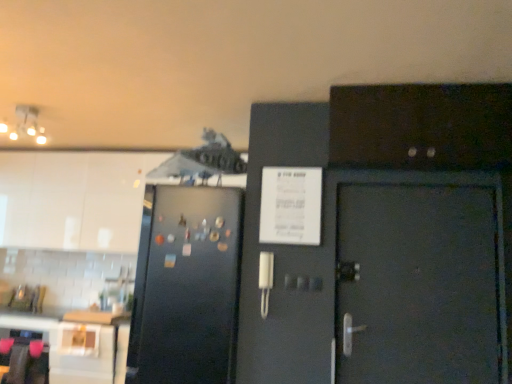
Question: Is black matte refrigerator at left at the back of dark wood cabinet at upper right, marked as the 1th cabinetry in a right-to-left arrangement?

Choices:
 (A) no
 (B) yes

Answer: (A)

Question: Does dark wood cabinet at upper right, placed as the 1th cabinetry when sorted from front to back, have a lesser width compared to black matte refrigerator at left?

Choices:
 (A) no
 (B) yes

Answer: (B)

Question: Are dark wood cabinet at upper right, marked as the 1th cabinetry in a right-to-left arrangement, and black matte refrigerator at left beside each other?

Choices:
 (A) yes
 (B) no

Answer: (B)

Question: Are dark wood cabinet at upper right, arranged as the second cabinetry when viewed from the back, and black matte refrigerator at left located far from each other?

Choices:
 (A) no
 (B) yes

Answer: (B)

Question: From the image's perspective, is dark wood cabinet at upper right, marked as the 1th cabinetry in a right-to-left arrangement, under black matte refrigerator at left?

Choices:
 (A) yes
 (B) no

Answer: (B)

Question: Looking at the image, does dark wood cabinet at upper right, positioned as the second cabinetry in left-to-right order, seem bigger or smaller compared to white glossy table at lower left?

Choices:
 (A) big
 (B) small

Answer: (B)

Question: Considering the positions of dark wood cabinet at upper right, arranged as the second cabinetry when viewed from the back, and white glossy table at lower left in the image, is dark wood cabinet at upper right, arranged as the second cabinetry when viewed from the back, taller or shorter than white glossy table at lower left?

Choices:
 (A) short
 (B) tall

Answer: (A)

Question: From a real-world perspective, is dark wood cabinet at upper right, marked as the 1th cabinetry in a right-to-left arrangement, physically located above or below white glossy table at lower left?

Choices:
 (A) above
 (B) below

Answer: (A)

Question: From the image's perspective, is dark wood cabinet at upper right, arranged as the second cabinetry when viewed from the back, above or below white glossy table at lower left?

Choices:
 (A) below
 (B) above

Answer: (B)

Question: In terms of height, does black matte refrigerator at left look taller or shorter compared to white glossy cabinet at upper left, which is counted as the second cabinetry, starting from the right?

Choices:
 (A) tall
 (B) short

Answer: (A)

Question: Considering the positions of black matte refrigerator at left and white glossy cabinet at upper left, which is counted as the second cabinetry, starting from the right, in the image, is black matte refrigerator at left bigger or smaller than white glossy cabinet at upper left, which is counted as the second cabinetry, starting from the right,?

Choices:
 (A) big
 (B) small

Answer: (B)

Question: Would you say black matte refrigerator at left is to the left or to the right of white glossy cabinet at upper left, marked as the 1th cabinetry in a back-to-front arrangement, in the picture?

Choices:
 (A) right
 (B) left

Answer: (A)

Question: From the image's perspective, is black matte refrigerator at left above or below white glossy cabinet at upper left, marked as the 1th cabinetry in a left-to-right arrangement?

Choices:
 (A) below
 (B) above

Answer: (A)

Question: From the image's perspective, relative to black matte refrigerator at left, is white glossy table at lower left above or below?

Choices:
 (A) below
 (B) above

Answer: (A)

Question: Considering the positions of white glossy table at lower left and black matte refrigerator at left in the image, is white glossy table at lower left wider or thinner than black matte refrigerator at left?

Choices:
 (A) thin
 (B) wide

Answer: (A)